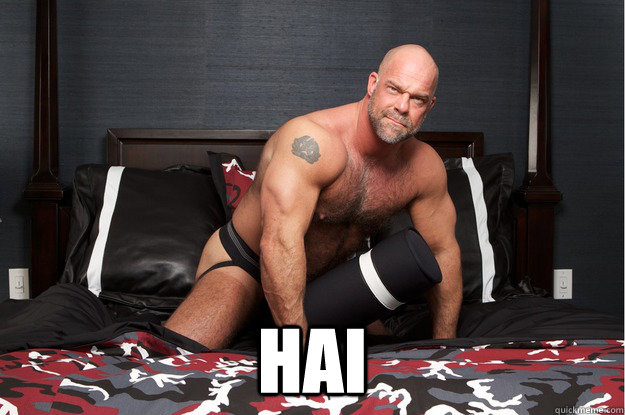
Image resolution: width=625 pixels, height=415 pixels. I want to click on cushion, so click(415, 266).